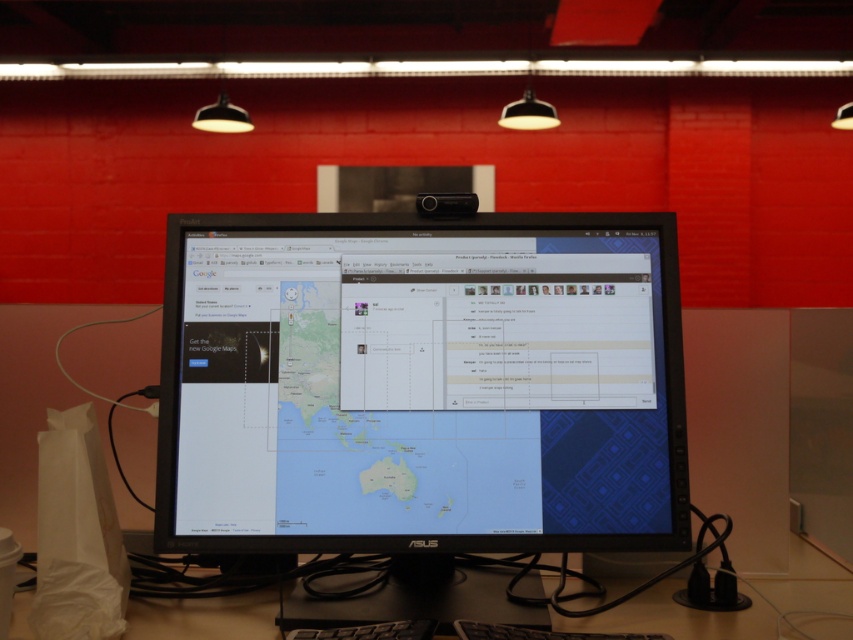
Question: Is black glossy monitor at center below black plastic computer desk at lower center?

Choices:
 (A) no
 (B) yes

Answer: (A)

Question: Which point is closer to the camera taking this photo?

Choices:
 (A) (352, 548)
 (B) (770, 611)

Answer: (A)

Question: Among these points, which one is nearest to the camera?

Choices:
 (A) (277, 259)
 (B) (695, 614)

Answer: (B)

Question: Can you confirm if black glossy monitor at center is positioned to the right of black plastic computer desk at lower center?

Choices:
 (A) yes
 (B) no

Answer: (B)

Question: Is black glossy monitor at center closer to camera compared to black plastic computer desk at lower center?

Choices:
 (A) yes
 (B) no

Answer: (A)